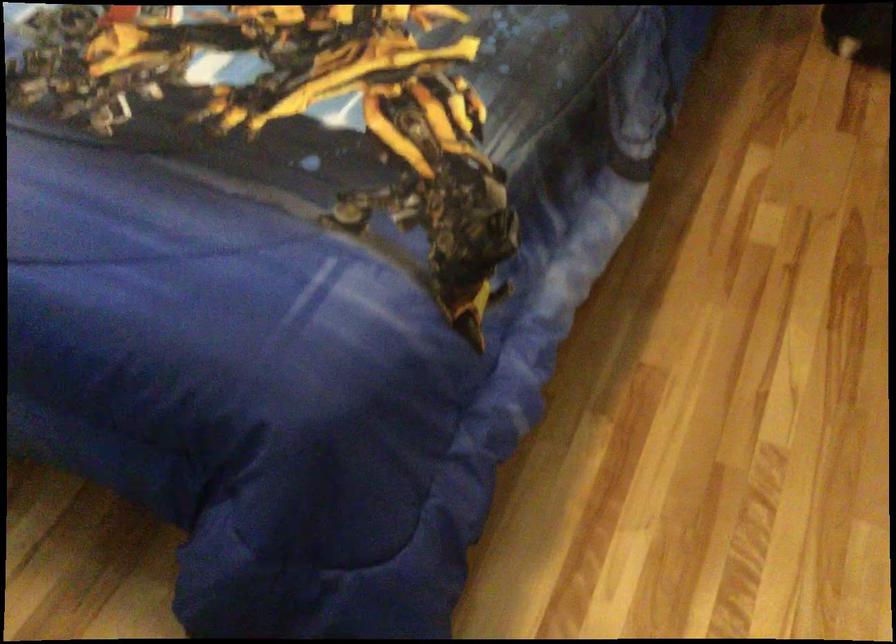
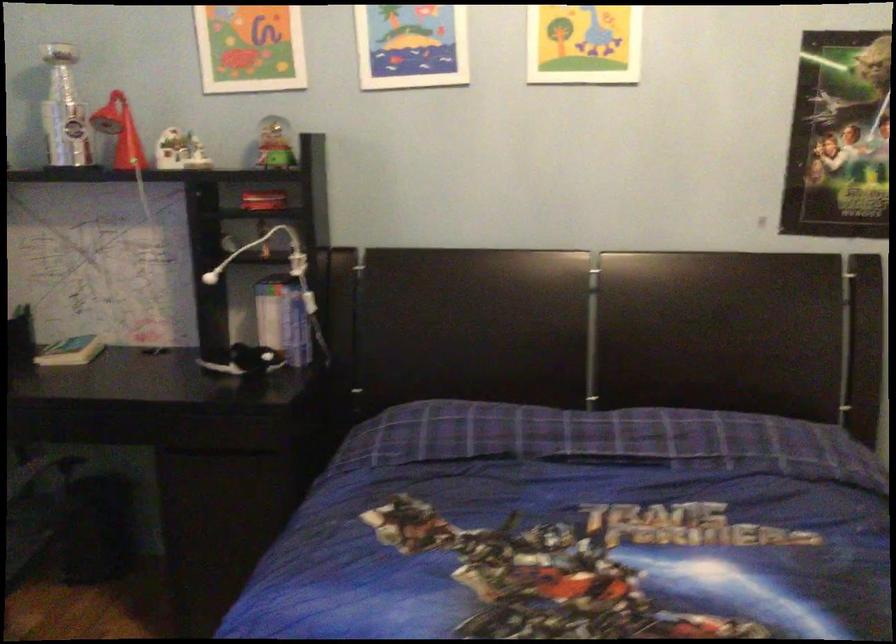
The first image is from the beginning of the video and the second image is from the end. How did the camera likely rotate when shooting the video?

The rotation direction of the camera is right-up.